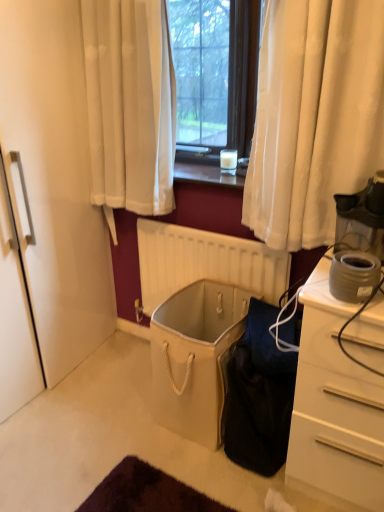
The height and width of the screenshot is (512, 384). What do you see at coordinates (259, 396) in the screenshot?
I see `black fabric bag at lower center` at bounding box center [259, 396].

The width and height of the screenshot is (384, 512). I want to click on beige fabric laundry basket at center, so click(x=195, y=357).

The width and height of the screenshot is (384, 512). Describe the element at coordinates (205, 263) in the screenshot. I see `beige matte radiator at center` at that location.

What do you see at coordinates (362, 219) in the screenshot?
I see `transparent plastic coffee maker at right, positioned as the 1th appliance in top-to-bottom order` at bounding box center [362, 219].

Where is `matte gray coffee maker at right, which is counted as the 1th appliance, starting from the bottom`? This screenshot has width=384, height=512. matte gray coffee maker at right, which is counted as the 1th appliance, starting from the bottom is located at coordinates (353, 275).

Find the location of `black fabric bag at lower center`. black fabric bag at lower center is located at coordinates (259, 396).

Can you confirm if translucent glass coffee cup at center is wider than matte gray coffee maker at right, which is the second appliance in top-to-bottom order?

No.

Is translucent glass coffee cup at center oriented towards matte gray coffee maker at right, which is the second appliance in top-to-bottom order?

No, translucent glass coffee cup at center is not aimed at matte gray coffee maker at right, which is the second appliance in top-to-bottom order.

Is translucent glass coffee cup at center completely or partially outside of matte gray coffee maker at right, which is counted as the 1th appliance, starting from the bottom?

Yes, translucent glass coffee cup at center is outside of matte gray coffee maker at right, which is counted as the 1th appliance, starting from the bottom.

Locate an element on the screen. The image size is (384, 512). luggage and bags in front of the translucent glass coffee cup at center is located at coordinates (259, 396).

Which is less distant, [253,307] or [233,170]?

Positioned in front is point [253,307].

Looking at this image, is black fabric bag at lower center thinner than translucent glass coffee cup at center?

In fact, black fabric bag at lower center might be wider than translucent glass coffee cup at center.

In terms of height, does translucent glass coffee cup at center look taller or shorter compared to black fabric bag at lower center?

In the image, translucent glass coffee cup at center appears to be shorter than black fabric bag at lower center.

Is translucent glass coffee cup at center in contact with black fabric bag at lower center?

No, translucent glass coffee cup at center is not making contact with black fabric bag at lower center.

How different are the orientations of translucent glass coffee cup at center and black fabric bag at lower center in degrees?

translucent glass coffee cup at center and black fabric bag at lower center are facing 4.15 degrees away from each other.

In the image, there is a black fabric bag at lower center. Where is `coffee cup above it (from the image's perspective)`? Image resolution: width=384 pixels, height=512 pixels. coffee cup above it (from the image's perspective) is located at coordinates (228, 161).

Who is bigger, beige fabric laundry basket at center or translucent glass coffee cup at center?

With larger size is beige fabric laundry basket at center.

Would you say beige fabric laundry basket at center contains translucent glass coffee cup at center?

No, translucent glass coffee cup at center is located outside of beige fabric laundry basket at center.

From a real-world perspective, is beige fabric laundry basket at center located beneath translucent glass coffee cup at center?

Correct, in the physical world, beige fabric laundry basket at center is lower than translucent glass coffee cup at center.

Relative to translucent glass coffee cup at center, is beige fabric laundry basket at center in front or behind?

beige fabric laundry basket at center is positioned closer to the viewer than translucent glass coffee cup at center.

Which is behind, matte gray coffee maker at right, which is counted as the 1th appliance, starting from the bottom, or translucent glass coffee cup at center?

translucent glass coffee cup at center is more distant.

From a real-world perspective, is matte gray coffee maker at right, which is the second appliance in top-to-bottom order, positioned above or below translucent glass coffee cup at center?

matte gray coffee maker at right, which is the second appliance in top-to-bottom order, is situated lower than translucent glass coffee cup at center in the real world.

Does matte gray coffee maker at right, which is counted as the 1th appliance, starting from the bottom, have a greater width compared to translucent glass coffee cup at center?

Yes.

Is matte gray coffee maker at right, which is counted as the 1th appliance, starting from the bottom, not close to translucent glass coffee cup at center?

matte gray coffee maker at right, which is counted as the 1th appliance, starting from the bottom, is near translucent glass coffee cup at center, not far away.

From the image's perspective, does beige fabric laundry basket at center appear lower than matte gray coffee maker at right, which is counted as the 1th appliance, starting from the bottom?

Yes, from the image's perspective, beige fabric laundry basket at center is beneath matte gray coffee maker at right, which is counted as the 1th appliance, starting from the bottom.

Is beige fabric laundry basket at center not within matte gray coffee maker at right, which is counted as the 1th appliance, starting from the bottom?

beige fabric laundry basket at center is positioned outside matte gray coffee maker at right, which is counted as the 1th appliance, starting from the bottom.

Considering the positions of objects beige fabric laundry basket at center and matte gray coffee maker at right, which is the second appliance in top-to-bottom order, in the image provided, who is behind, beige fabric laundry basket at center or matte gray coffee maker at right, which is the second appliance in top-to-bottom order,?

beige fabric laundry basket at center is more distant.

Which of these two, beige fabric laundry basket at center or matte gray coffee maker at right, which is the second appliance in top-to-bottom order, is smaller?

matte gray coffee maker at right, which is the second appliance in top-to-bottom order.

Based on the photo, can you confirm if translucent glass coffee cup at center is taller than beige matte radiator at center?

In fact, translucent glass coffee cup at center may be shorter than beige matte radiator at center.

Considering the sizes of objects translucent glass coffee cup at center and beige matte radiator at center in the image provided, who is thinner, translucent glass coffee cup at center or beige matte radiator at center?

translucent glass coffee cup at center.

Measure the distance between translucent glass coffee cup at center and beige matte radiator at center.

translucent glass coffee cup at center is 17.44 inches from beige matte radiator at center.

Is translucent glass coffee cup at center to the left of beige matte radiator at center from the viewer's perspective?

Incorrect, translucent glass coffee cup at center is not on the left side of beige matte radiator at center.

Image resolution: width=384 pixels, height=512 pixels. Identify the location of coffee cup above the matte gray coffee maker at right, which is the second appliance in top-to-bottom order (from a real-world perspective). (228, 161).

This screenshot has height=512, width=384. I want to click on luggage and bags lying on the right of translucent glass coffee cup at center, so click(259, 396).

Looking at the image, which one is located further to matte gray coffee maker at right, which is the second appliance in top-to-bottom order, beige matte radiator at center or transparent plastic coffee maker at right, the 2th appliance from the bottom?

Among the two, beige matte radiator at center is located further to matte gray coffee maker at right, which is the second appliance in top-to-bottom order.

Based on their spatial positions, is beige fabric laundry basket at center or beige matte radiator at center further from matte gray coffee maker at right, which is counted as the 1th appliance, starting from the bottom?

Among the two, beige matte radiator at center is located further to matte gray coffee maker at right, which is counted as the 1th appliance, starting from the bottom.

From the image, which object appears to be farther from translucent glass coffee cup at center, beige matte radiator at center or matte gray coffee maker at right, which is counted as the 1th appliance, starting from the bottom?

Among the two, matte gray coffee maker at right, which is counted as the 1th appliance, starting from the bottom, is located further to translucent glass coffee cup at center.

Estimate the real-world distances between objects in this image. Which object is further from translucent glass coffee cup at center, transparent plastic coffee maker at right, the 2th appliance from the bottom, or matte gray coffee maker at right, which is counted as the 1th appliance, starting from the bottom?

matte gray coffee maker at right, which is counted as the 1th appliance, starting from the bottom, lies further to translucent glass coffee cup at center than the other object.

From the image, which object appears to be nearer to beige fabric laundry basket at center, transparent plastic coffee maker at right, the 2th appliance from the bottom, or translucent glass coffee cup at center?

Based on the image, transparent plastic coffee maker at right, the 2th appliance from the bottom, appears to be nearer to beige fabric laundry basket at center.

Considering their positions, is beige matte radiator at center positioned closer to matte gray coffee maker at right, which is the second appliance in top-to-bottom order, than black fabric bag at lower center?

black fabric bag at lower center lies closer to matte gray coffee maker at right, which is the second appliance in top-to-bottom order, than the other object.

Which object lies nearer to the anchor point translucent glass coffee cup at center, black fabric bag at lower center or beige fabric laundry basket at center?

Based on the image, beige fabric laundry basket at center appears to be nearer to translucent glass coffee cup at center.

Based on their spatial positions, is beige fabric laundry basket at center or beige matte radiator at center further from black fabric bag at lower center?

beige matte radiator at center is further to black fabric bag at lower center.

The width and height of the screenshot is (384, 512). I want to click on laundry basket positioned between black fabric bag at lower center and beige matte radiator at center from near to far, so click(195, 357).

Where is `radiator between translucent glass coffee cup at center and black fabric bag at lower center from top to bottom`? The image size is (384, 512). radiator between translucent glass coffee cup at center and black fabric bag at lower center from top to bottom is located at coordinates (205, 263).

Locate an element on the screen. This screenshot has width=384, height=512. laundry basket between transparent plastic coffee maker at right, positioned as the 1th appliance in top-to-bottom order, and beige matte radiator at center, along the z-axis is located at coordinates (195, 357).

Where is `radiator that lies between translucent glass coffee cup at center and beige fabric laundry basket at center from top to bottom`? radiator that lies between translucent glass coffee cup at center and beige fabric laundry basket at center from top to bottom is located at coordinates (205, 263).